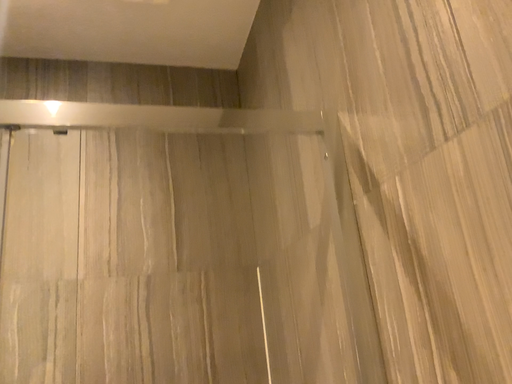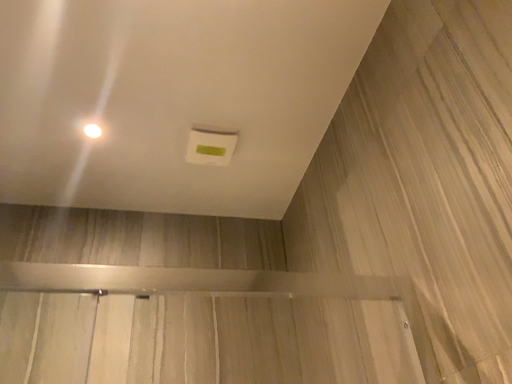
Question: How did the camera likely rotate when shooting the video?

Choices:
 (A) rotated downward
 (B) rotated upward

Answer: (B)